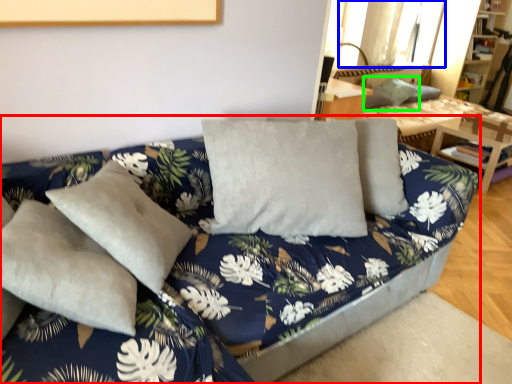
Question: Which object is positioned farthest from studio couch (highlighted by a red box)? Select from window (highlighted by a blue box) and pillow (highlighted by a green box).

Choices:
 (A) window
 (B) pillow

Answer: (A)